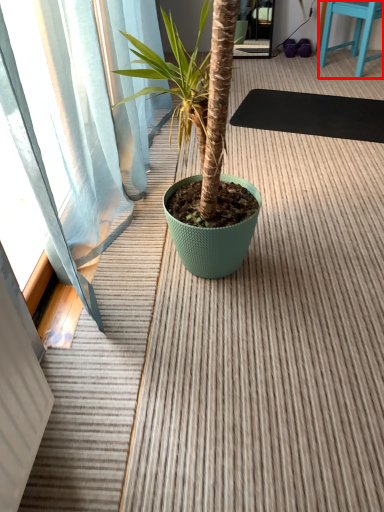
Question: From the image, what is the correct spatial relationship of furniture (annotated by the red box) in relation to yoga mat?

Choices:
 (A) right
 (B) left

Answer: (A)